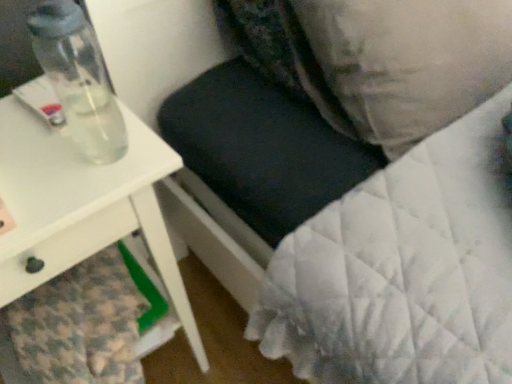
Question: From a real-world perspective, is velvety black pillow at upper center, positioned as the 2th pillow in right-to-left order, physically above clear glass bottle at left?

Choices:
 (A) no
 (B) yes

Answer: (A)

Question: Is velvety black pillow at upper center, the first pillow from the left, not near clear glass bottle at left?

Choices:
 (A) no
 (B) yes

Answer: (A)

Question: Is velvety black pillow at upper center, the first pillow from the left, closer to camera compared to clear glass bottle at left?

Choices:
 (A) no
 (B) yes

Answer: (A)

Question: Is velvety black pillow at upper center, the first pillow from the left, oriented away from clear glass bottle at left?

Choices:
 (A) no
 (B) yes

Answer: (A)

Question: Is velvety black pillow at upper center, positioned as the 2th pillow in right-to-left order, further to camera compared to clear glass bottle at left?

Choices:
 (A) no
 (B) yes

Answer: (B)

Question: Considering the relative positions of velvety black pillow at upper center, positioned as the 2th pillow in right-to-left order, and clear glass bottle at left in the image provided, is velvety black pillow at upper center, positioned as the 2th pillow in right-to-left order, to the left of clear glass bottle at left from the viewer's perspective?

Choices:
 (A) no
 (B) yes

Answer: (A)

Question: Is white quilted pillow at upper right, the 2th pillow when ordered from left to right, surrounded by clear glass bottle at left?

Choices:
 (A) yes
 (B) no

Answer: (B)

Question: Does clear glass bottle at left appear on the right side of white quilted pillow at upper right, arranged as the first pillow when viewed from the right?

Choices:
 (A) no
 (B) yes

Answer: (A)

Question: Considering the relative sizes of clear glass bottle at left and white quilted pillow at upper right, arranged as the first pillow when viewed from the right, in the image provided, is clear glass bottle at left taller than white quilted pillow at upper right, arranged as the first pillow when viewed from the right,?

Choices:
 (A) no
 (B) yes

Answer: (A)

Question: Can you confirm if clear glass bottle at left is bigger than white quilted pillow at upper right, the 2th pillow when ordered from left to right?

Choices:
 (A) no
 (B) yes

Answer: (A)

Question: Is clear glass bottle at left positioned before white quilted pillow at upper right, the 2th pillow when ordered from left to right?

Choices:
 (A) yes
 (B) no

Answer: (A)

Question: Is clear glass bottle at left at the left side of white quilted pillow at upper right, the 2th pillow when ordered from left to right?

Choices:
 (A) no
 (B) yes

Answer: (B)

Question: Is white glossy table at left oriented away from velvety black pillow at upper center, positioned as the 2th pillow in right-to-left order?

Choices:
 (A) yes
 (B) no

Answer: (B)